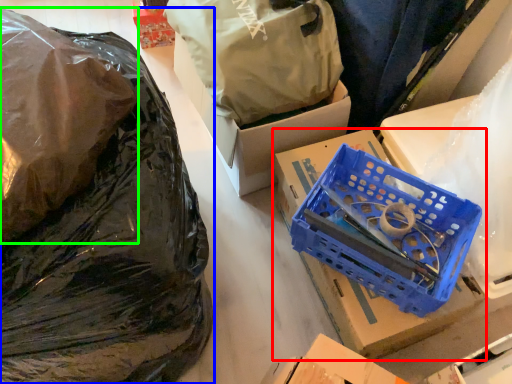
Question: Considering the real-world distances, which object is closest to box (highlighted by a red box)? plastic bag (highlighted by a blue box) or plastic bag (highlighted by a green box).

Choices:
 (A) plastic bag
 (B) plastic bag

Answer: (A)